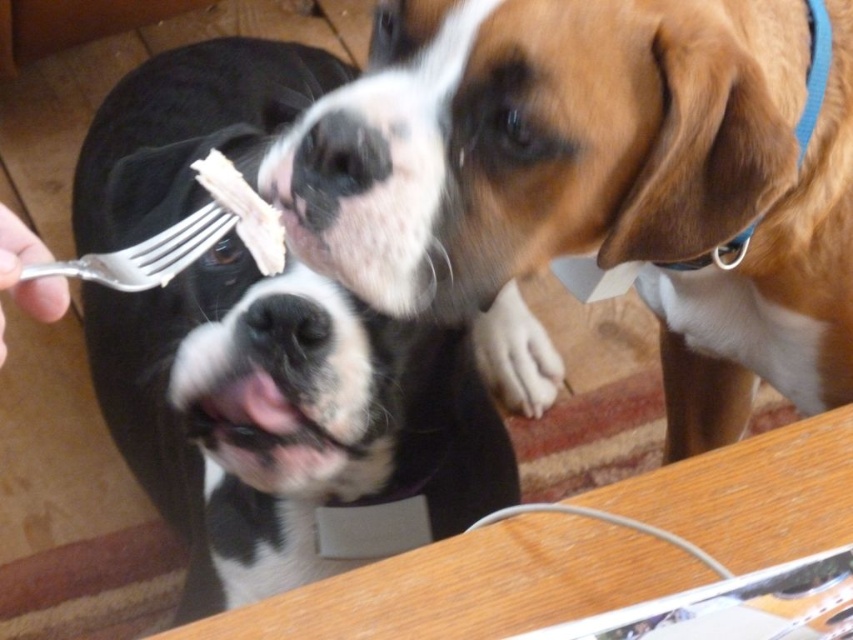
You are a dog trainer observing the scene. You need to decide which object is wider between the brown furry dog at upper right and the silver metallic fork at lower left. Which one is wider?

The brown furry dog at upper right is wider than the silver metallic fork at lower left according to the description.